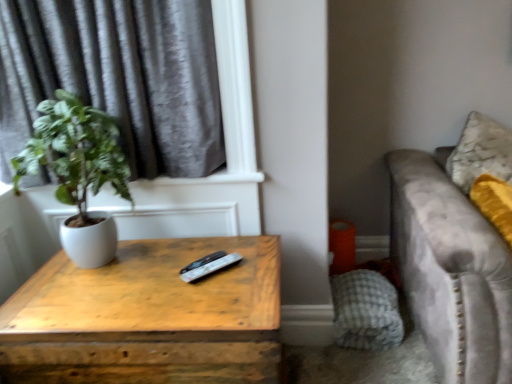
Question: From a real-world perspective, does gray velvet curtain at upper left stand above gray checkered pillow at lower right?

Choices:
 (A) yes
 (B) no

Answer: (A)

Question: Can you confirm if gray velvet curtain at upper left is thinner than gray checkered pillow at lower right?

Choices:
 (A) no
 (B) yes

Answer: (B)

Question: From the image's perspective, is gray velvet curtain at upper left beneath gray checkered pillow at lower right?

Choices:
 (A) no
 (B) yes

Answer: (A)

Question: Does gray velvet curtain at upper left have a lesser height compared to gray checkered pillow at lower right?

Choices:
 (A) no
 (B) yes

Answer: (A)

Question: Is gray velvet curtain at upper left to the left of gray checkered pillow at lower right from the viewer's perspective?

Choices:
 (A) no
 (B) yes

Answer: (B)

Question: Is gray velvet curtain at upper left wider than gray checkered pillow at lower right?

Choices:
 (A) yes
 (B) no

Answer: (B)

Question: Are wooden table at center and black plastic remote at center located far from each other?

Choices:
 (A) yes
 (B) no

Answer: (B)

Question: Is wooden table at center directly adjacent to black plastic remote at center?

Choices:
 (A) yes
 (B) no

Answer: (B)

Question: Is wooden table at center smaller than black plastic remote at center?

Choices:
 (A) yes
 (B) no

Answer: (B)

Question: Could black plastic remote at center be considered to be inside wooden table at center?

Choices:
 (A) yes
 (B) no

Answer: (B)

Question: Is wooden table at center positioned before black plastic remote at center?

Choices:
 (A) yes
 (B) no

Answer: (A)

Question: From a real-world perspective, is wooden table at center located beneath black plastic remote at center?

Choices:
 (A) no
 (B) yes

Answer: (B)

Question: Is wooden table at center not inside gray velvet curtain at upper left?

Choices:
 (A) yes
 (B) no

Answer: (A)